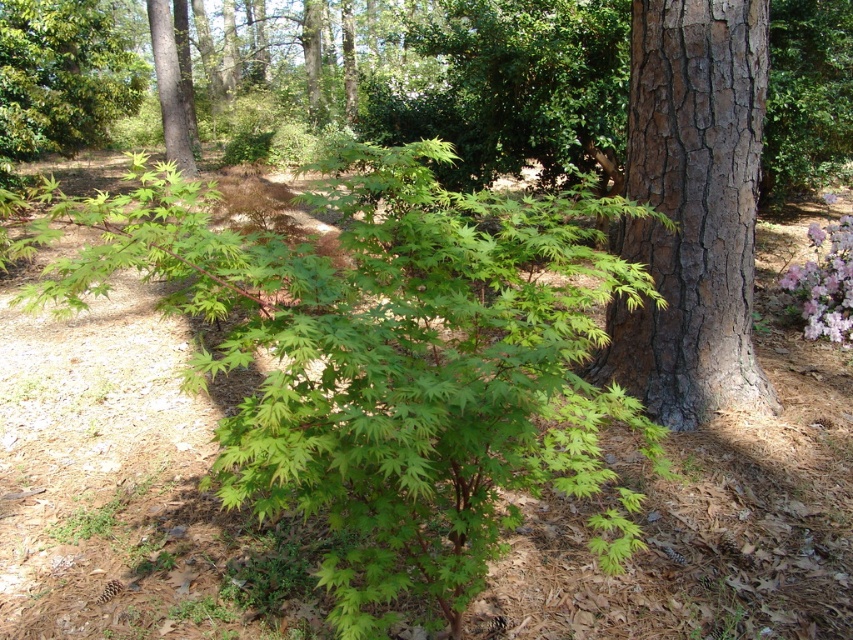
Is smooth brown bark at right taller than pink matte flowers at lower right?

Yes, smooth brown bark at right is taller than pink matte flowers at lower right.

Is point (637, 388) closer to viewer compared to point (827, 260)?

That is True.

Between point (665, 307) and point (793, 273), which one is positioned in front?

Point (665, 307)

Find the location of `smooth brown bark at right`. smooth brown bark at right is located at coordinates (692, 209).

Does point (512, 392) come closer to viewer compared to point (845, 252)?

Yes, it is.

Can you confirm if green leafy maple at center is positioned to the left of pink matte flowers at lower right?

Yes, green leafy maple at center is to the left of pink matte flowers at lower right.

Image resolution: width=853 pixels, height=640 pixels. What do you see at coordinates (386, 358) in the screenshot?
I see `green leafy maple at center` at bounding box center [386, 358].

This screenshot has width=853, height=640. I want to click on green leafy maple at center, so [x=386, y=358].

Is point (680, 145) positioned before point (165, 104)?

Yes.

Who is taller, smooth brown bark at right or smooth brown tree trunk at upper center?

smooth brown tree trunk at upper center

Between point (641, 152) and point (155, 58), which one is positioned in front?

Point (641, 152) is in front.

This screenshot has width=853, height=640. What are the coordinates of `smooth brown bark at right` in the screenshot? It's located at (692, 209).